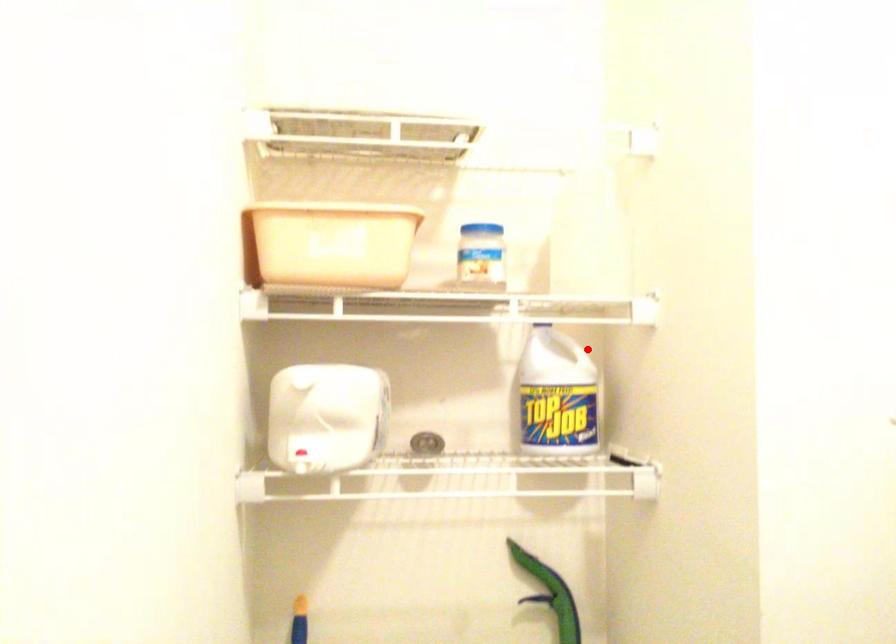
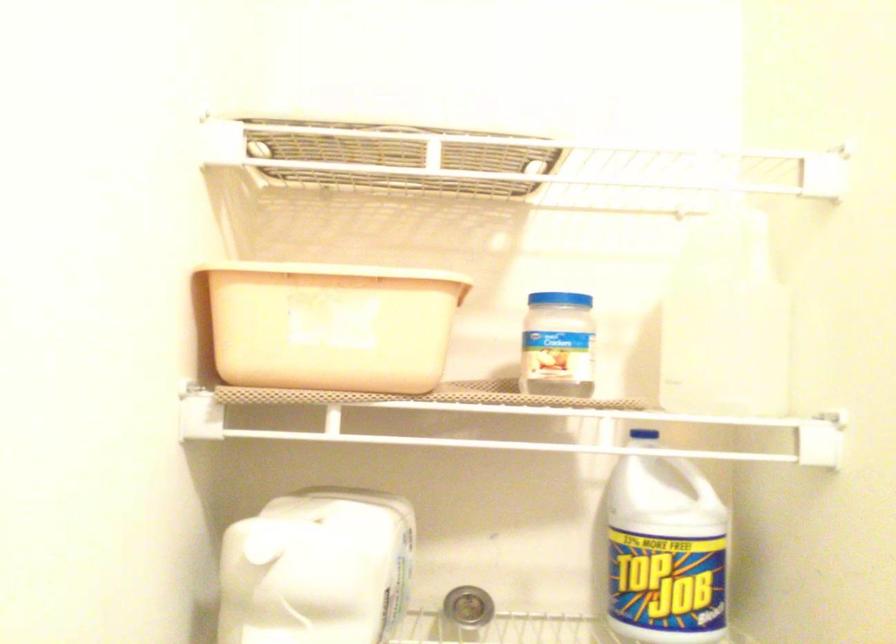
In the second image, find the point that corresponds to the highlighted location in the first image.

(704, 471)